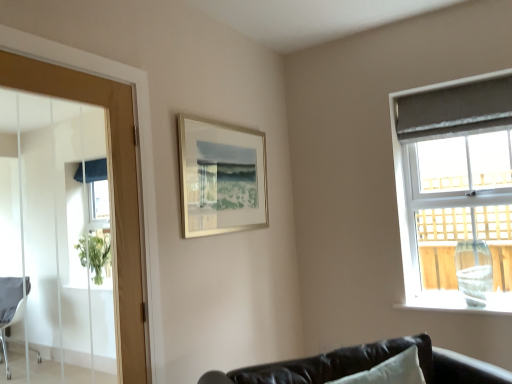
Question: Does matte gray curtain at right have a lesser width compared to wooden door at left?

Choices:
 (A) no
 (B) yes

Answer: (A)

Question: Is matte gray curtain at right to the left of wooden door at left from the viewer's perspective?

Choices:
 (A) yes
 (B) no

Answer: (B)

Question: Does matte gray curtain at right come behind wooden door at left?

Choices:
 (A) yes
 (B) no

Answer: (A)

Question: Considering the relative positions of matte gray curtain at right and wooden door at left in the image provided, is matte gray curtain at right to the right of wooden door at left from the viewer's perspective?

Choices:
 (A) no
 (B) yes

Answer: (B)

Question: Is matte gray curtain at right taller than wooden door at left?

Choices:
 (A) no
 (B) yes

Answer: (B)

Question: From the image's perspective, is matte gray curtain at right located beneath wooden door at left?

Choices:
 (A) no
 (B) yes

Answer: (A)

Question: Considering the relative positions of matte gray curtain at right and silver metallic picture frame at upper center in the image provided, is matte gray curtain at right in front of silver metallic picture frame at upper center?

Choices:
 (A) yes
 (B) no

Answer: (B)

Question: From the image's perspective, is matte gray curtain at right under silver metallic picture frame at upper center?

Choices:
 (A) no
 (B) yes

Answer: (B)

Question: Is matte gray curtain at right smaller than silver metallic picture frame at upper center?

Choices:
 (A) no
 (B) yes

Answer: (A)

Question: From a real-world perspective, is matte gray curtain at right positioned under silver metallic picture frame at upper center based on gravity?

Choices:
 (A) yes
 (B) no

Answer: (A)

Question: Can you confirm if matte gray curtain at right is shorter than silver metallic picture frame at upper center?

Choices:
 (A) yes
 (B) no

Answer: (B)

Question: Is matte gray curtain at right behind silver metallic picture frame at upper center?

Choices:
 (A) yes
 (B) no

Answer: (A)

Question: From the image's perspective, is wooden door at left on top of matte gray curtain at right?

Choices:
 (A) no
 (B) yes

Answer: (A)